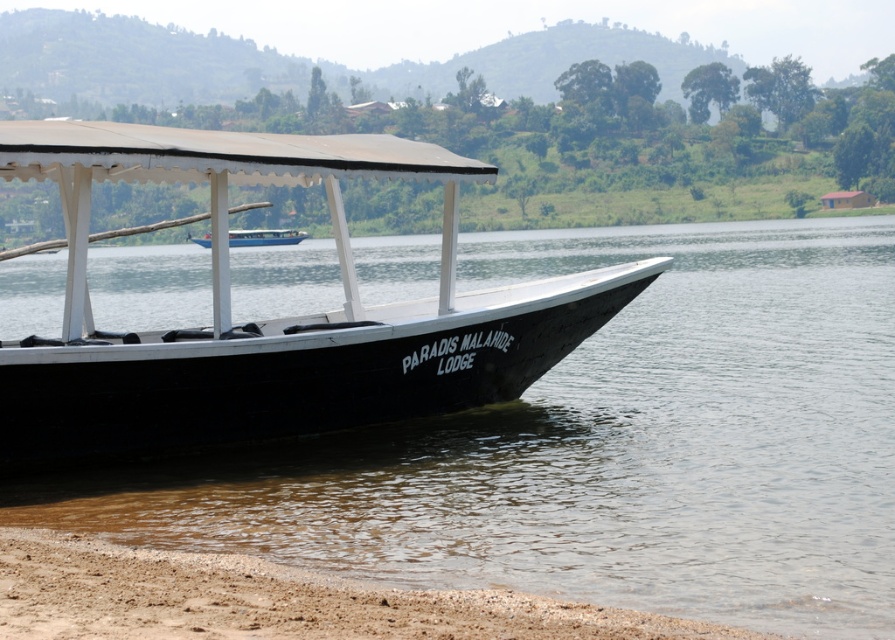
Question: Which object is closer to the camera taking this photo?

Choices:
 (A) black wood boat at center
 (B) brown sandy shore at lower left
 (C) clear water at boat right

Answer: (B)

Question: Estimate the real-world distances between objects in this image. Which object is closer to the clear water at boat right?

Choices:
 (A) brown sandy shore at lower left
 (B) blue glossy boat at center

Answer: (B)

Question: Which of these objects is positioned closest to the brown sandy shore at lower left?

Choices:
 (A) clear water at boat right
 (B) black wood boat at center

Answer: (B)

Question: Does clear water at boat right appear under blue glossy boat at center?

Choices:
 (A) no
 (B) yes

Answer: (B)

Question: Does clear water at boat right appear over blue glossy boat at center?

Choices:
 (A) yes
 (B) no

Answer: (B)

Question: Is black wood boat at center bigger than blue glossy boat at center?

Choices:
 (A) no
 (B) yes

Answer: (A)